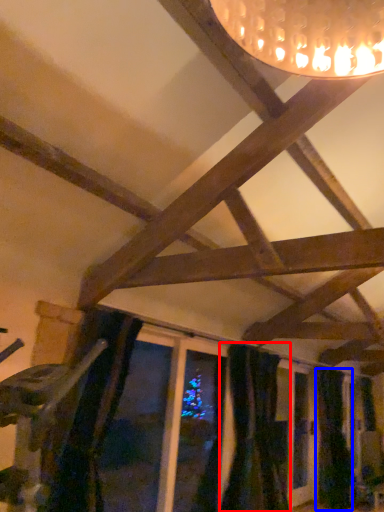
Question: Which of the following is the closest to the observer, curtain (highlighted by a red box) or curtain (highlighted by a blue box)?

Choices:
 (A) curtain
 (B) curtain

Answer: (A)